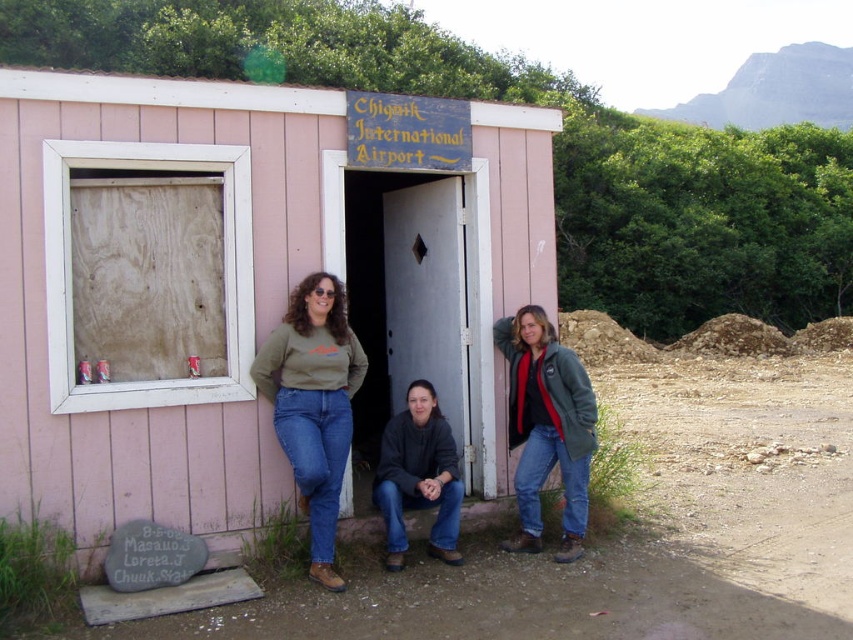
Question: Among these points, which one is farthest from the camera?

Choices:
 (A) pyautogui.click(x=430, y=472)
 (B) pyautogui.click(x=590, y=406)

Answer: (A)

Question: Considering the relative positions of jeans at center and matte green sweater at center in the image provided, where is jeans at center located with respect to matte green sweater at center?

Choices:
 (A) below
 (B) above

Answer: (B)

Question: Can you confirm if matte green sweater at center is bigger than green fleece jacket at right?

Choices:
 (A) no
 (B) yes

Answer: (B)

Question: Does jeans at center appear over dark gray sweater at center?

Choices:
 (A) no
 (B) yes

Answer: (B)

Question: Among these objects, which one is nearest to the camera?

Choices:
 (A) matte green sweater at center
 (B) pink wood hut at center
 (C) green fleece jacket at right

Answer: (B)

Question: Estimate the real-world distances between objects in this image. Which object is farther from the jeans at center?

Choices:
 (A) green fleece jacket at right
 (B) pink wood hut at center
 (C) matte green sweater at center
 (D) dark gray sweater at center

Answer: (A)